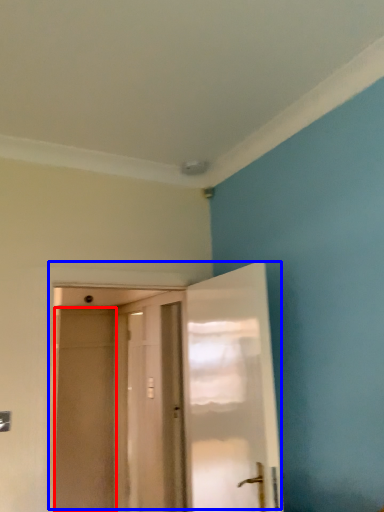
Question: Which object is further to the camera taking this photo, screen door (highlighted by a red box) or door (highlighted by a blue box)?

Choices:
 (A) screen door
 (B) door

Answer: (A)